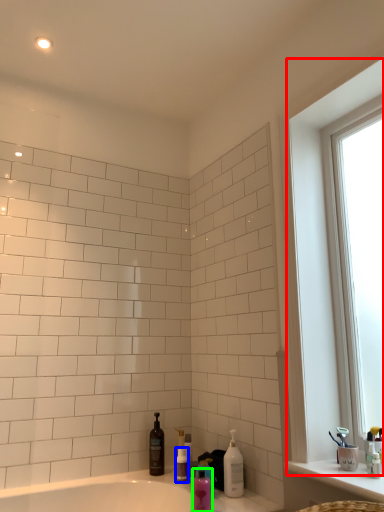
Question: Which object is the closest to the window (highlighted by a red box)? Choose among these: toiletry (highlighted by a blue box) or mouthwash (highlighted by a green box).

Choices:
 (A) toiletry
 (B) mouthwash

Answer: (B)